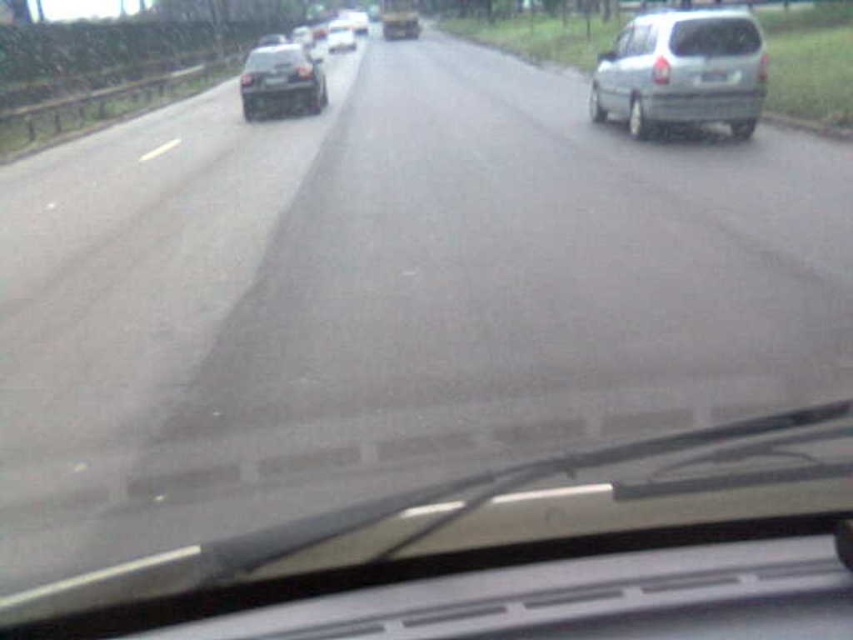
Question: In this image, where is white matte van at right located relative to shiny silver sedan at center?

Choices:
 (A) above
 (B) below

Answer: (B)

Question: Observing the image, what is the correct spatial positioning of glossy black car at center in reference to white plastic license plate at right?

Choices:
 (A) right
 (B) left

Answer: (B)

Question: Which is farther from the shiny silver sedan at center?

Choices:
 (A) glossy black car at center
 (B) white matte van at right

Answer: (A)

Question: In this image, where is transparent glass windshield at center located relative to shiny silver sedan at center?

Choices:
 (A) right
 (B) left

Answer: (A)

Question: Based on their relative distances, which object is farther from the shiny silver sedan at center?

Choices:
 (A) white matte van at right
 (B) white plastic license plate at right

Answer: (B)

Question: Estimate the real-world distances between objects in this image. Which object is closer to the white matte van at right?

Choices:
 (A) shiny silver sedan at center
 (B) transparent glass windshield at center

Answer: (B)